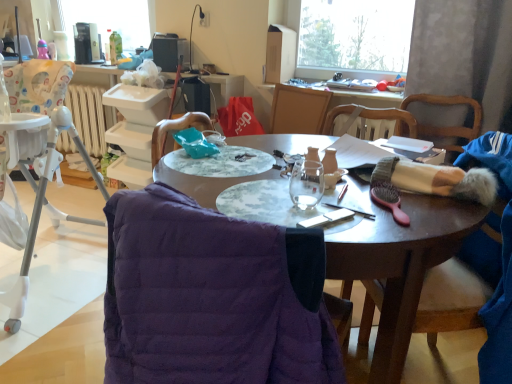
Locate an element on the screen. This screenshot has height=384, width=512. white plastic power outlet at upper center is located at coordinates (205, 19).

This screenshot has height=384, width=512. Describe the element at coordinates (90, 116) in the screenshot. I see `white plastic radiator at left` at that location.

Describe the element at coordinates (327, 218) in the screenshot. I see `silver metallic phone at center` at that location.

Measure the distance between point (193, 12) and camera.

The depth of point (193, 12) is 9.68 feet.

What do you see at coordinates (398, 262) in the screenshot? I see `matte purple jacket at lower left` at bounding box center [398, 262].

In order to face purple quilted jacket at center, which is the 2th chair from right to left, should I rotate leftwards or rightwards?

You should rotate left by 0.535 degrees.

The width and height of the screenshot is (512, 384). What do you see at coordinates (450, 300) in the screenshot? I see `wooden chair at right, the 1th chair in the right-to-left sequence` at bounding box center [450, 300].

Identify the location of white plastic power outlet at upper center. The height and width of the screenshot is (384, 512). (205, 19).

Is purple quilted jacket at center, which is the first chair from left to right, to the right of black plastic pen at center from the viewer's perspective?

No, purple quilted jacket at center, which is the first chair from left to right, is not to the right of black plastic pen at center.

The image size is (512, 384). I want to click on pen above the purple quilted jacket at center, which is the 2th chair from right to left (from a real-world perspective), so click(x=350, y=210).

Do you think purple quilted jacket at center, which is the 2th chair from right to left, is within black plastic pen at center, or outside of it?

purple quilted jacket at center, which is the 2th chair from right to left, is not enclosed by black plastic pen at center.

In terms of size, does purple quilted jacket at center, which is the first chair from left to right, appear bigger or smaller than black plastic pen at center?

Considering their sizes, purple quilted jacket at center, which is the first chair from left to right, takes up more space than black plastic pen at center.

Considering the relative sizes of black plastic pen at center and matte purple jacket at lower left in the image provided, is black plastic pen at center bigger than matte purple jacket at lower left?

No, black plastic pen at center is not bigger than matte purple jacket at lower left.

From the image's perspective, which object appears higher, black plastic pen at center or matte purple jacket at lower left?

black plastic pen at center, from the image's perspective.

How distant is black plastic pen at center from matte purple jacket at lower left?

They are 7.97 inches apart.

From a real-world perspective, is black plastic pen at center above or below matte purple jacket at lower left?

From a real-world perspective, black plastic pen at center is physically above matte purple jacket at lower left.

Is metallic black lamp at upper center far away from purple quilted jacket at center, which is the 2th chair from right to left?

Yes, metallic black lamp at upper center and purple quilted jacket at center, which is the 2th chair from right to left, are quite far apart.

Is metallic black lamp at upper center positioned before purple quilted jacket at center, which is the first chair from left to right?

No, the depth of metallic black lamp at upper center is greater than that of purple quilted jacket at center, which is the first chair from left to right.

In terms of height, does metallic black lamp at upper center look taller or shorter compared to purple quilted jacket at center, which is the 2th chair from right to left?

metallic black lamp at upper center is shorter than purple quilted jacket at center, which is the 2th chair from right to left.

Considering the sizes of metallic black lamp at upper center and purple quilted jacket at center, which is the first chair from left to right, in the image, is metallic black lamp at upper center bigger or smaller than purple quilted jacket at center, which is the first chair from left to right,?

Considering their sizes, metallic black lamp at upper center takes up less space than purple quilted jacket at center, which is the first chair from left to right.

Can we say white plastic highchair at left lies outside black plastic pen at center?

Absolutely, white plastic highchair at left is external to black plastic pen at center.

Is white plastic highchair at left smaller than black plastic pen at center?

Actually, white plastic highchair at left might be larger than black plastic pen at center.

Considering the sizes of objects white plastic highchair at left and black plastic pen at center in the image provided, who is taller, white plastic highchair at left or black plastic pen at center?

white plastic highchair at left.

In the image, is white plastic highchair at left positioned in front of or behind silver metallic phone at center?

Visually, white plastic highchair at left is located behind silver metallic phone at center.

From the picture: Is white plastic highchair at left placed right next to silver metallic phone at center?

No, white plastic highchair at left is not in contact with silver metallic phone at center.

Is white plastic highchair at left shorter than silver metallic phone at center?

No.

This screenshot has height=384, width=512. What are the coordinates of `feeding chair behind the silver metallic phone at center` in the screenshot? It's located at (41, 193).

Between green plastic bottle at upper left and white plastic power outlet at upper center, which one is positioned behind?

Positioned behind is green plastic bottle at upper left.

Between point (114, 45) and point (207, 25), which one is positioned behind?

The point (114, 45) is behind.

Is green plastic bottle at upper left not close to white plastic power outlet at upper center?

Actually, green plastic bottle at upper left and white plastic power outlet at upper center are a little close together.

Between wooden chair at right, the 1th chair in the right-to-left sequence, and green plastic bottle at upper left, which one has larger width?

wooden chair at right, the 1th chair in the right-to-left sequence, is wider.

Which chair is the 1st one when counting from the front of the green plastic bottle at upper left? Please provide its 2D coordinates.

[(450, 300)]

Is wooden chair at right, the 2th chair in the left-to-right sequence, not close to green plastic bottle at upper left?

Indeed, wooden chair at right, the 2th chair in the left-to-right sequence, is not near green plastic bottle at upper left.

From a real-world perspective, is wooden chair at right, the 1th chair in the right-to-left sequence, physically located above or below green plastic bottle at upper left?

From a real-world perspective, wooden chair at right, the 1th chair in the right-to-left sequence, is physically below green plastic bottle at upper left.

At what (x,y) coordinates should I click in order to perform the action: click on pen above the purple quilted jacket at center, which is the 2th chair from right to left (from the image's perspective). Please return your answer as a coordinate pair (x, y). Image resolution: width=512 pixels, height=384 pixels. Looking at the image, I should click on (350, 210).

Locate an element on the screen. pen above the matte purple jacket at lower left (from a real-world perspective) is located at coordinates (350, 210).

In the scene shown: Estimate the real-world distances between objects in this image. Which object is closer to matte purple jacket at lower left, white plastic highchair at left or silver metallic phone at center?

Based on the image, silver metallic phone at center appears to be nearer to matte purple jacket at lower left.

Based on their spatial positions, is white plastic power outlet at upper center or white plastic highchair at left closer to purple quilted jacket at center, which is the first chair from left to right?

white plastic highchair at left lies closer to purple quilted jacket at center, which is the first chair from left to right, than the other object.

Considering their positions, is green plastic bottle at upper left positioned closer to black plastic pen at center than purple quilted jacket at center, which is the 2th chair from right to left?

Among the two, purple quilted jacket at center, which is the 2th chair from right to left, is located nearer to black plastic pen at center.

When comparing their distances from metallic black lamp at upper center, does matte purple jacket at lower left or silver metallic phone at center seem closer?

matte purple jacket at lower left is positioned closer to the anchor metallic black lamp at upper center.

From the image, which object appears to be nearer to purple quilted jacket at center, which is the first chair from left to right, wooden chair at right, the 1th chair in the right-to-left sequence, or silver metallic phone at center?

silver metallic phone at center is closer to purple quilted jacket at center, which is the first chair from left to right.

Which object lies nearer to the anchor point matte purple jacket at lower left, white plastic power outlet at upper center or white plastic highchair at left?

white plastic highchair at left lies closer to matte purple jacket at lower left than the other object.

Looking at the image, which one is located further to white plastic radiator at left, matte purple jacket at lower left or wooden chair at right, the 2th chair in the left-to-right sequence?

Among the two, wooden chair at right, the 2th chair in the left-to-right sequence, is located further to white plastic radiator at left.

Based on their spatial positions, is purple quilted jacket at center, which is the 2th chair from right to left, or silver metallic phone at center closer to wooden chair at right, the 2th chair in the left-to-right sequence?

silver metallic phone at center.

The height and width of the screenshot is (384, 512). Find the location of `mobile phone between black plastic pen at center and purple quilted jacket at center, which is the 2th chair from right to left, from top to bottom`. mobile phone between black plastic pen at center and purple quilted jacket at center, which is the 2th chair from right to left, from top to bottom is located at coordinates (327, 218).

The height and width of the screenshot is (384, 512). Find the location of `desk between silver metallic phone at center and purple quilted jacket at center, which is the first chair from left to right, in the vertical direction`. desk between silver metallic phone at center and purple quilted jacket at center, which is the first chair from left to right, in the vertical direction is located at coordinates (398, 262).

What are the coordinates of `mobile phone located between purple quilted jacket at center, which is the first chair from left to right, and wooden chair at right, the 1th chair in the right-to-left sequence, in the left-right direction` in the screenshot? It's located at (327, 218).

This screenshot has width=512, height=384. In order to click on power outlet located between wooden chair at right, the 2th chair in the left-to-right sequence, and green plastic bottle at upper left in the depth direction in this screenshot , I will do `click(205, 19)`.